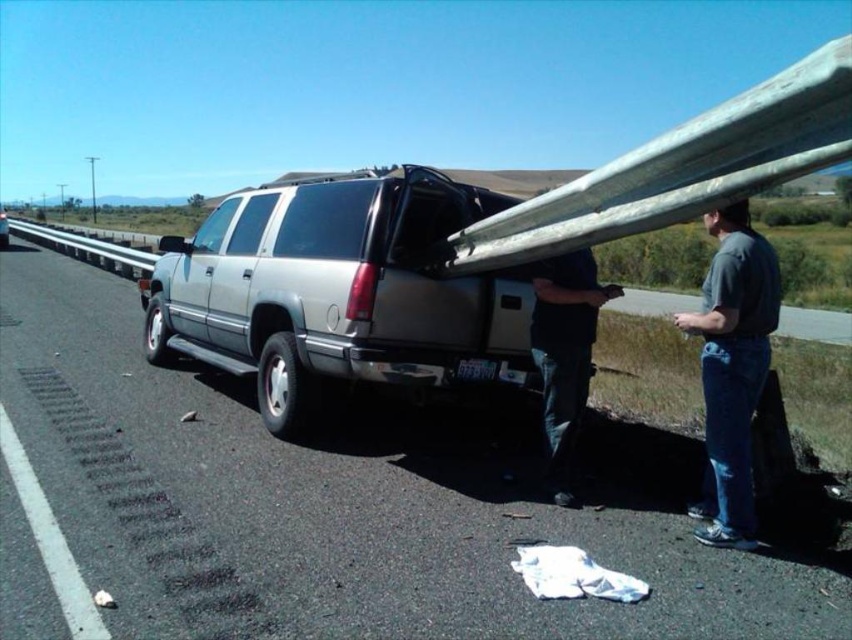
Question: Is brushed metal highway at center to the left of dark blue jeans at lower center from the viewer's perspective?

Choices:
 (A) yes
 (B) no

Answer: (A)

Question: Among these objects, which one is nearest to the camera?

Choices:
 (A) silver metallic suv at center
 (B) dark blue jeans at lower center
 (C) gray cotton shirt at right

Answer: (C)

Question: Which of the following is the closest to the observer?

Choices:
 (A) brushed metal highway at center
 (B) silver metallic suv at center
 (C) gray cotton shirt at right
 (D) dark blue jeans at lower center

Answer: (A)

Question: Which point appears farthest from the camera in this image?

Choices:
 (A) pos(735,272)
 (B) pos(430,269)

Answer: (B)

Question: Is brushed metal highway at center closer to the viewer compared to silver metallic suv at center?

Choices:
 (A) no
 (B) yes

Answer: (B)

Question: Observing the image, what is the correct spatial positioning of silver metallic suv at center in reference to dark blue jeans at lower center?

Choices:
 (A) above
 (B) below

Answer: (A)